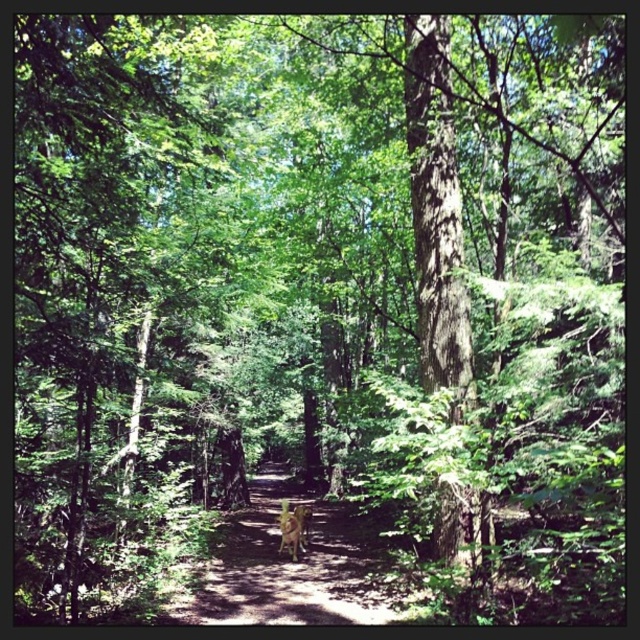
Question: Is brown textured path at center smaller than brown wooden bench at center?

Choices:
 (A) yes
 (B) no

Answer: (B)

Question: Can you confirm if brown textured path at center is positioned to the left of brown wooden bench at center?

Choices:
 (A) yes
 (B) no

Answer: (A)

Question: Is brown textured path at center wider than brown wooden bench at center?

Choices:
 (A) yes
 (B) no

Answer: (A)

Question: Which object is closer to the camera taking this photo?

Choices:
 (A) brown textured path at center
 (B) brown wooden bench at center

Answer: (A)